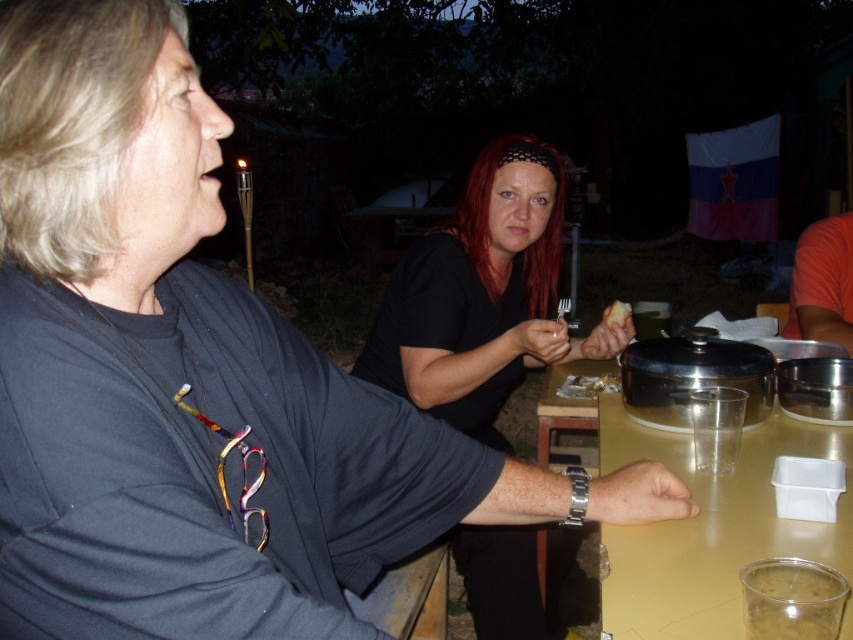
Question: Does translucent plastic table at center have a smaller size compared to clear plastic cup at lower right?

Choices:
 (A) no
 (B) yes

Answer: (A)

Question: Can you confirm if black matte shirt at center is positioned above clear plastic cup at lower right?

Choices:
 (A) no
 (B) yes

Answer: (B)

Question: Among these objects, which one is nearest to the camera?

Choices:
 (A) black matte shirt at center
 (B) translucent plastic table at center
 (C) clear plastic cup at lower right
 (D) yellow crumbly bread at center

Answer: (C)

Question: Estimate the real-world distances between objects in this image. Which object is closer to the orange t-shirt at right?

Choices:
 (A) translucent plastic table at center
 (B) clear plastic cup at lower right
 (C) yellow crumbly bread at center
 (D) black matte shirt at center

Answer: (C)

Question: Does black matte shirt at center have a larger size compared to yellow crumbly bread at center?

Choices:
 (A) yes
 (B) no

Answer: (A)

Question: Which object is farther from the camera taking this photo?

Choices:
 (A) clear plastic cup at lower right
 (B) black matte shirt at center
 (C) yellow crumbly bread at center
 (D) translucent plastic table at center

Answer: (C)